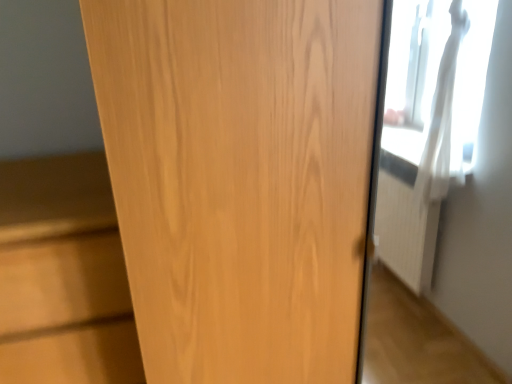
Find the location of a particular element. wooden door at center is located at coordinates (241, 180).

What do you see at coordinates (241, 180) in the screenshot? Image resolution: width=512 pixels, height=384 pixels. I see `wooden door at center` at bounding box center [241, 180].

What is the approximate height of wooden door at center?

It is 5.41 feet.

The width and height of the screenshot is (512, 384). Describe the element at coordinates (63, 276) in the screenshot. I see `light wood cabinet at left` at that location.

Where is `light wood cabinet at left`? The width and height of the screenshot is (512, 384). light wood cabinet at left is located at coordinates (63, 276).

What is the approximate width of light wood cabinet at left?

52.49 centimeters.

Where is `wooden door at center`? wooden door at center is located at coordinates (241, 180).

Visually, is wooden door at center positioned to the left or to the right of light wood cabinet at left?

Based on their positions, wooden door at center is located to the right of light wood cabinet at left.

Which object is further away from the camera, wooden door at center or light wood cabinet at left?

Positioned behind is light wood cabinet at left.

Which is farther, [236,96] or [70,329]?

The point [70,329] is farther from the camera.

From the image's perspective, who appears lower, wooden door at center or light wood cabinet at left?

light wood cabinet at left appears lower in the image.

From a real-world perspective, is wooden door at center located higher than light wood cabinet at left?

Yes, from a real-world perspective, wooden door at center is over light wood cabinet at left

Which of these two, wooden door at center or light wood cabinet at left, is thinner?

Thinner between the two is light wood cabinet at left.

Considering the sizes of wooden door at center and light wood cabinet at left in the image, is wooden door at center taller or shorter than light wood cabinet at left?

Considering their sizes, wooden door at center has more height than light wood cabinet at left.

Considering the relative sizes of wooden door at center and light wood cabinet at left in the image provided, is wooden door at center smaller than light wood cabinet at left?

Incorrect, wooden door at center is not smaller in size than light wood cabinet at left.

Is light wood cabinet at left located within wooden door at center?

Definitely not — light wood cabinet at left is not inside wooden door at center.

Would you consider wooden door at center to be distant from light wood cabinet at left?

wooden door at center is near light wood cabinet at left, not far away.

Does wooden door at center turn towards light wood cabinet at left?

No.

Where is `door above the light wood cabinet at left (from a real-world perspective)`? Image resolution: width=512 pixels, height=384 pixels. door above the light wood cabinet at left (from a real-world perspective) is located at coordinates (241, 180).

In the scene shown: Considering the positions of objects light wood cabinet at left and wooden door at center in the image provided, who is more to the left, light wood cabinet at left or wooden door at center?

light wood cabinet at left.

Based on the photo, is light wood cabinet at left in front of wooden door at center?

No, light wood cabinet at left is behind wooden door at center.

Which is more distant, (x=102, y=277) or (x=111, y=174)?

Point (x=102, y=277)

From the image's perspective, is light wood cabinet at left above or below wooden door at center?

Clearly, from the image's perspective, light wood cabinet at left is below wooden door at center.

From a real-world perspective, which is physically below, light wood cabinet at left or wooden door at center?

light wood cabinet at left is physically lower.

Between light wood cabinet at left and wooden door at center, which one has smaller width?

Thinner between the two is light wood cabinet at left.

From their relative heights in the image, would you say light wood cabinet at left is taller or shorter than wooden door at center?

light wood cabinet at left is shorter than wooden door at center.

Can you confirm if light wood cabinet at left is smaller than wooden door at center?

Yes, light wood cabinet at left is smaller than wooden door at center.

Can wooden door at center be found inside light wood cabinet at left?

No, wooden door at center is not surrounded by light wood cabinet at left.

Is light wood cabinet at left not near wooden door at center?

No.

Is light wood cabinet at left facing away from wooden door at center?

No, light wood cabinet at left is not facing away from wooden door at center.

What's the angular difference between light wood cabinet at left and wooden door at center's facing directions?

There is a 0.518-degree angle between the facing directions of light wood cabinet at left and wooden door at center.

I want to click on door that appears above the light wood cabinet at left (from a real-world perspective), so click(x=241, y=180).

This screenshot has width=512, height=384. In order to click on door above the light wood cabinet at left (from the image's perspective) in this screenshot , I will do `click(241, 180)`.

This screenshot has height=384, width=512. Find the location of `cabinetry below the wooden door at center (from a real-world perspective)`. cabinetry below the wooden door at center (from a real-world perspective) is located at coordinates (63, 276).